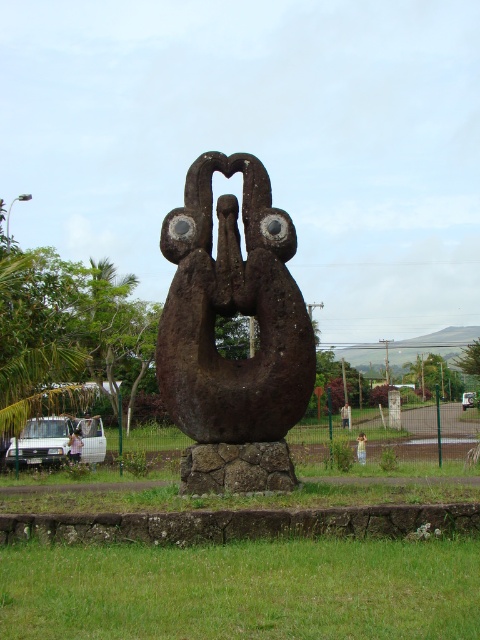
Question: Does rusty stone sculpture at center have a larger size compared to white fabric at lower left?

Choices:
 (A) yes
 (B) no

Answer: (A)

Question: Can you confirm if rusty stone sculpture at center is positioned above brown wooden statue at center?

Choices:
 (A) yes
 (B) no

Answer: (A)

Question: Does green grass at lower center appear on the left side of brown wooden statue at center?

Choices:
 (A) yes
 (B) no

Answer: (A)

Question: Which object is positioned farthest from the green grass at lower center?

Choices:
 (A) brown wooden statue at center
 (B) rusty stone sculpture at center
 (C) white fabric at lower left
 (D) light brown wooden person at center

Answer: (A)

Question: Among these points, which one is nearest to the camera?

Choices:
 (A) (204, 170)
 (B) (76, 436)

Answer: (A)

Question: Among these objects, which one is farthest from the camera?

Choices:
 (A) brown wooden statue at center
 (B) green grass at lower center
 (C) light brown wooden person at center
 (D) rusty stone sculpture at center

Answer: (A)